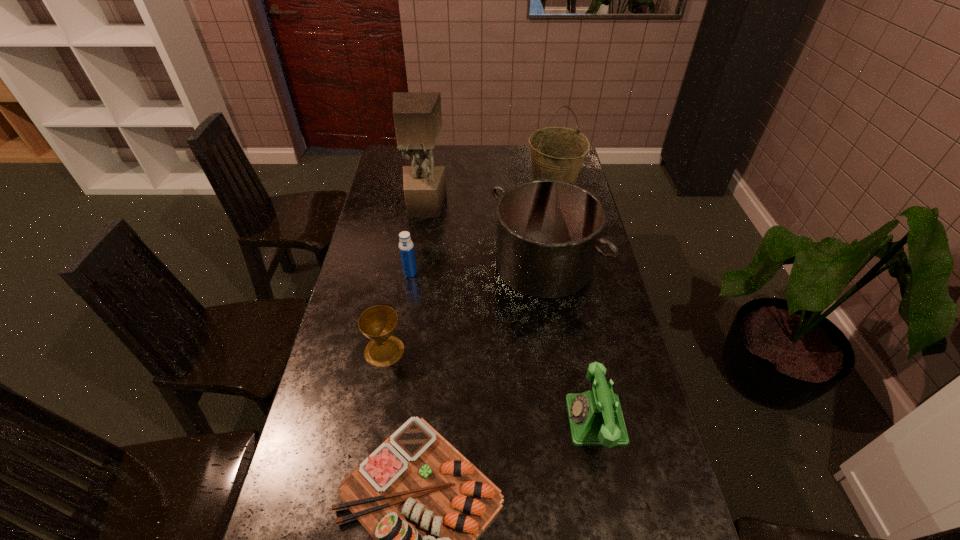
Where is `sculpture`? sculpture is located at coordinates (417, 116).

Where is `the second tallest object`? the second tallest object is located at coordinates (557, 153).

The image size is (960, 540). I want to click on pan, so pos(548,231).

Where is `the fourth tallest object`? Image resolution: width=960 pixels, height=540 pixels. the fourth tallest object is located at coordinates (406, 248).

The height and width of the screenshot is (540, 960). Find the location of `chalice`. chalice is located at coordinates (378, 323).

Locate an element on the screen. telephone is located at coordinates (595, 416).

Image resolution: width=960 pixels, height=540 pixels. In order to click on vacant space situated on the front-facing side of the tallest object in this screenshot , I will do `click(421, 227)`.

This screenshot has width=960, height=540. Identify the location of free space located on the back of the wine bucket. (544, 146).

At what (x,y) coordinates should I click in order to perform the action: click on blank area located on the left of the third tallest object. Please return your answer as a coordinate pair (x, y). Looking at the image, I should click on (468, 265).

The height and width of the screenshot is (540, 960). Find the location of `blank area located 0.360m on the right of the fourth tallest object`. blank area located 0.360m on the right of the fourth tallest object is located at coordinates (521, 273).